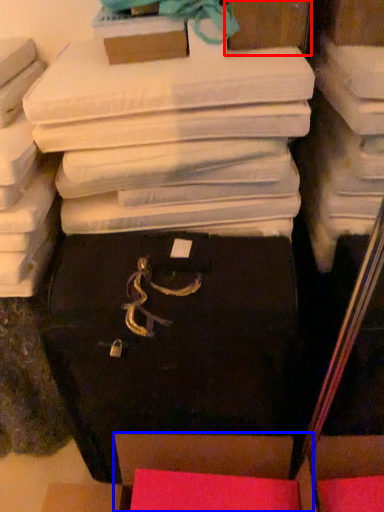
Question: Which of the following is the farthest to the observer, storage box (highlighted by a red box) or storage box (highlighted by a blue box)?

Choices:
 (A) storage box
 (B) storage box

Answer: (A)